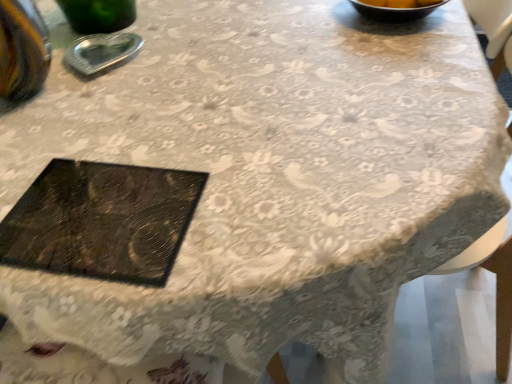
Question: Considering their positions, is metallic silver ashtray at upper left located in front of or behind black textured tray at center?

Choices:
 (A) behind
 (B) front

Answer: (A)

Question: Would you say metallic silver ashtray at upper left is inside or outside black textured tray at center?

Choices:
 (A) outside
 (B) inside

Answer: (A)

Question: Is metallic silver ashtray at upper left bigger or smaller than black textured tray at center?

Choices:
 (A) small
 (B) big

Answer: (A)

Question: Looking at their shapes, would you say black textured tray at center is wider or thinner than metallic silver ashtray at upper left?

Choices:
 (A) thin
 (B) wide

Answer: (B)

Question: Considering their positions, is black textured tray at center located in front of or behind metallic silver ashtray at upper left?

Choices:
 (A) behind
 (B) front

Answer: (B)

Question: From their relative heights in the image, would you say black textured tray at center is taller or shorter than metallic silver ashtray at upper left?

Choices:
 (A) short
 (B) tall

Answer: (A)

Question: From the image's perspective, relative to metallic silver ashtray at upper left, is black textured tray at center above or below?

Choices:
 (A) below
 (B) above

Answer: (A)